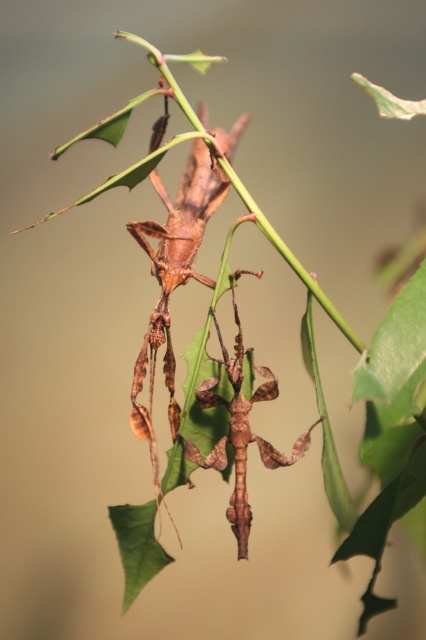
Which is in front, point (175, 419) or point (201, 467)?

Point (201, 467) is in front.

The height and width of the screenshot is (640, 426). I want to click on brown matte stick insect at center, so click(172, 276).

Where is `brown matte stick insect at center`? The height and width of the screenshot is (640, 426). brown matte stick insect at center is located at coordinates (172, 276).